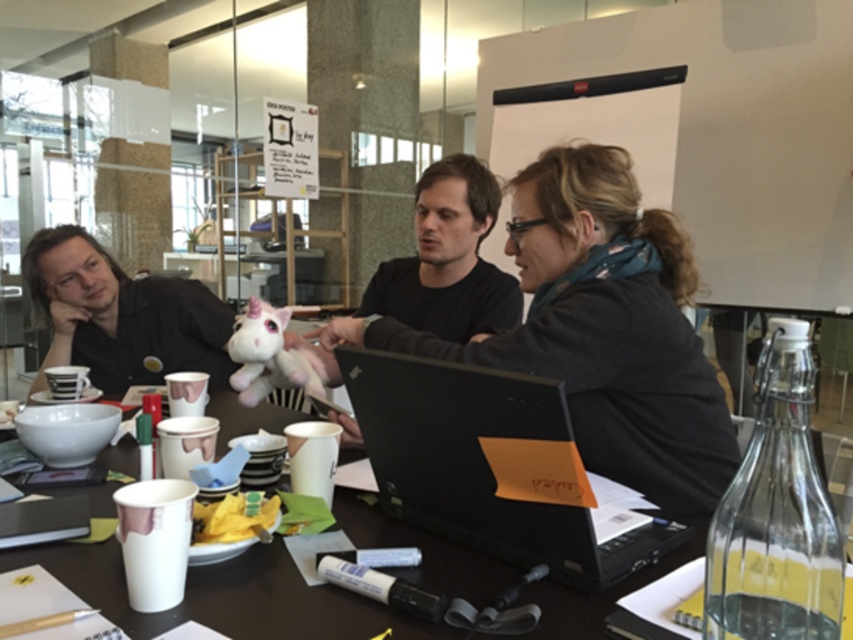
Between black matte shirt at left and pink plush unicorn at center, which one appears on the right side from the viewer's perspective?

From the viewer's perspective, pink plush unicorn at center appears more on the right side.

This screenshot has height=640, width=853. What do you see at coordinates (120, 314) in the screenshot?
I see `black matte shirt at left` at bounding box center [120, 314].

Does point (169, 296) come farther from viewer compared to point (282, 330)?

Yes.

You are a GUI agent. You are given a task and a screenshot of the screen. Output one action in this format:
    pyautogui.click(x=<x>, y=<y>)
    Task: Click on the black matte shirt at left
    
    Given the screenshot: What is the action you would take?
    pyautogui.click(x=120, y=314)

Is white paper cup at center smaller than black matte laptop at center?

No, white paper cup at center is not smaller than black matte laptop at center.

What do you see at coordinates (223, 595) in the screenshot?
I see `white paper cup at center` at bounding box center [223, 595].

What are the coordinates of `white paper cup at center` in the screenshot? It's located at click(x=223, y=595).

This screenshot has width=853, height=640. Identify the location of white paper cup at center. (223, 595).

Between white paper cup at center and pink plush unicorn at center, which one is positioned lower?

white paper cup at center is below.

Does point (610, 588) come in front of point (238, 376)?

Yes.

Locate an element on the screen. The image size is (853, 640). white paper cup at center is located at coordinates (223, 595).